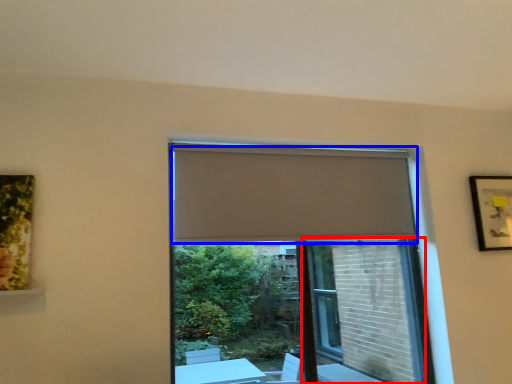
Question: Which object is closer to the camera taking this photo, screen door (highlighted by a red box) or curtain (highlighted by a blue box)?

Choices:
 (A) screen door
 (B) curtain

Answer: (B)